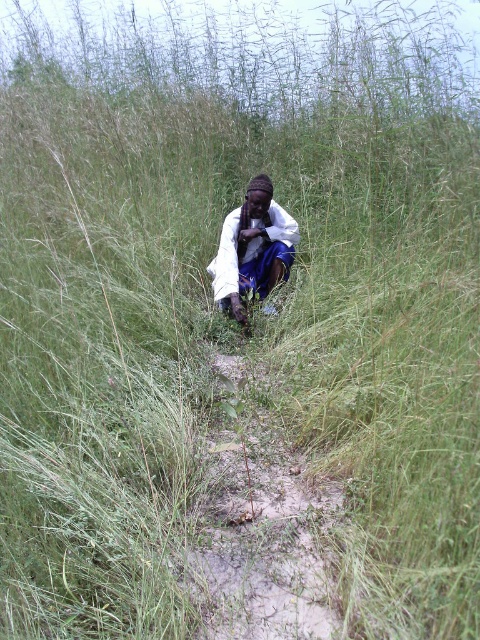
Question: Which point appears farthest from the camera in this image?

Choices:
 (A) (223, 356)
 (B) (220, 292)

Answer: (B)

Question: Which point is closer to the camera taking this photo?

Choices:
 (A) (252, 280)
 (B) (255, 536)

Answer: (B)

Question: Is the position of dirt path at center more distant than that of white matte shirt at center?

Choices:
 (A) yes
 (B) no

Answer: (B)

Question: Does dirt path at center appear on the right side of white matte shirt at center?

Choices:
 (A) no
 (B) yes

Answer: (B)

Question: Is dirt path at center positioned at the back of white matte shirt at center?

Choices:
 (A) yes
 (B) no

Answer: (B)